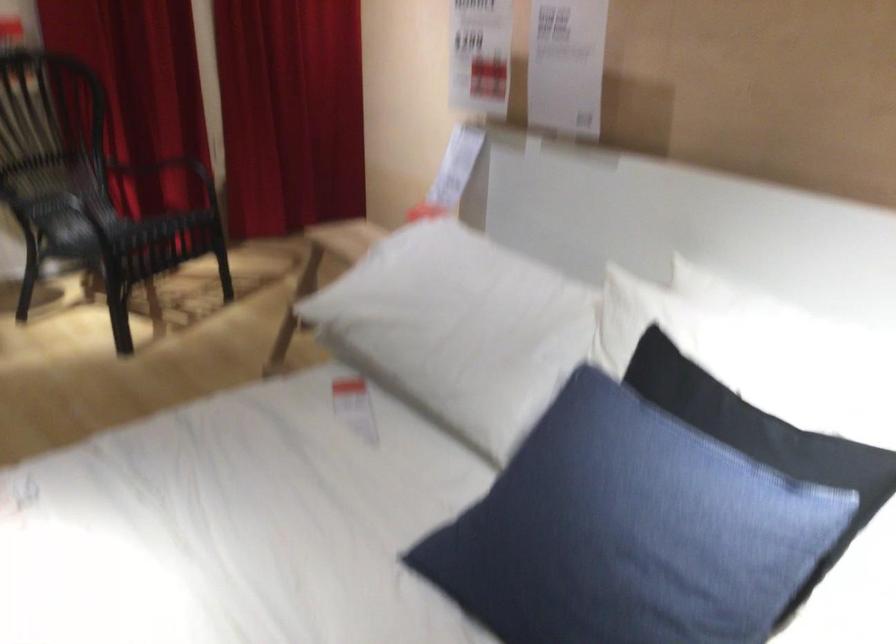
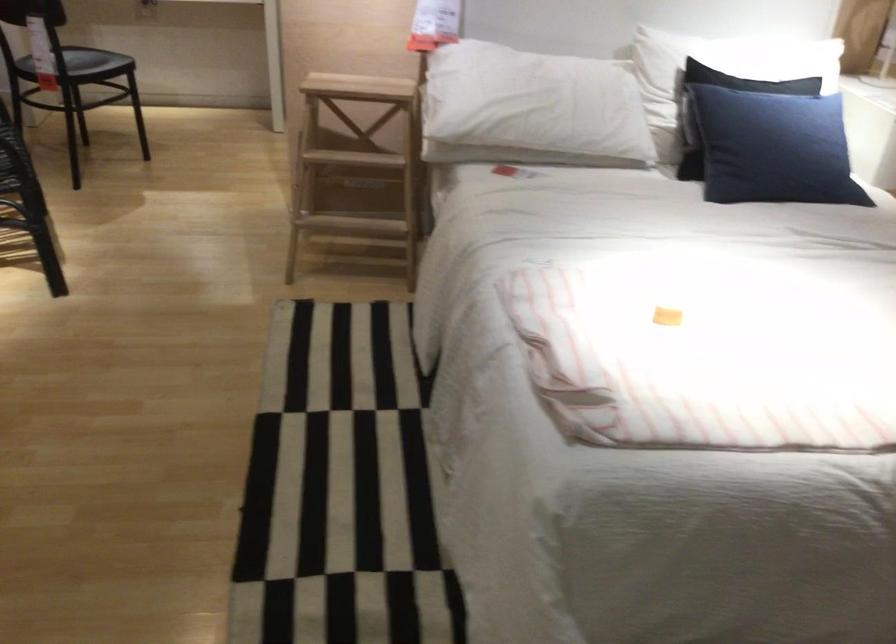
The point at (546, 538) is marked in the first image. Where is the corresponding point in the second image?

(773, 147)